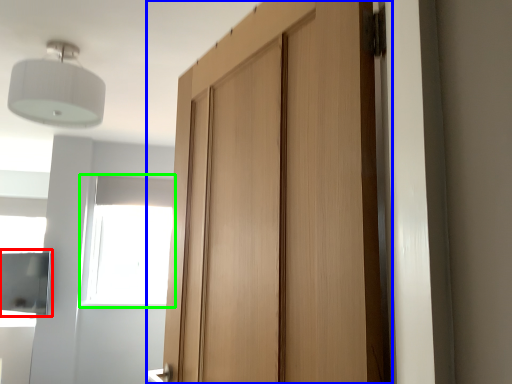
Question: Considering the real-world distances, which object is farthest from cabinetry (highlighted by a red box)? door (highlighted by a blue box) or window (highlighted by a green box)?

Choices:
 (A) door
 (B) window

Answer: (A)